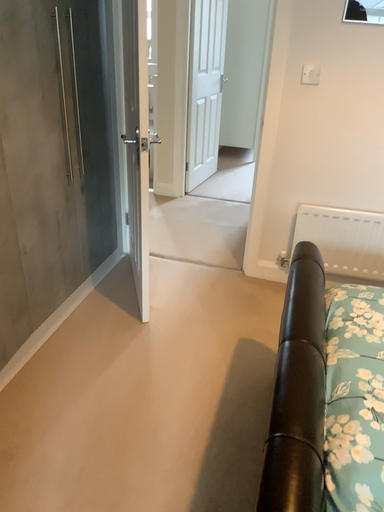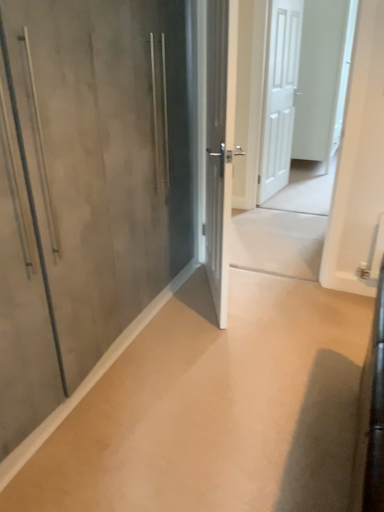
Question: Which way did the camera rotate in the video?

Choices:
 (A) rotated left
 (B) rotated right

Answer: (A)